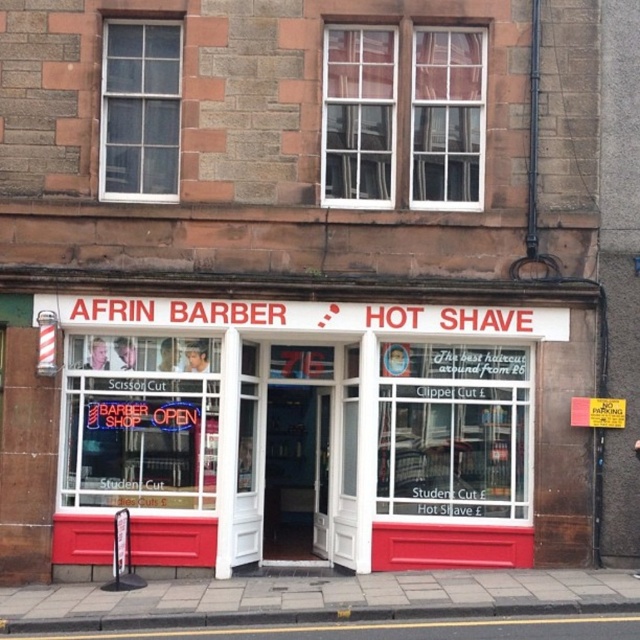
Question: Is matte glass storefront at center thinner than concrete at lower center?

Choices:
 (A) no
 (B) yes

Answer: (B)

Question: Does matte glass storefront at center have a smaller size compared to concrete at lower center?

Choices:
 (A) yes
 (B) no

Answer: (B)

Question: Can you confirm if matte glass storefront at center is thinner than concrete at lower center?

Choices:
 (A) yes
 (B) no

Answer: (A)

Question: Which of the following is the farthest from the observer?

Choices:
 (A) (33, 630)
 (B) (365, 337)

Answer: (B)

Question: Which point is closer to the camera?

Choices:
 (A) matte glass storefront at center
 (B) concrete at lower center

Answer: (B)